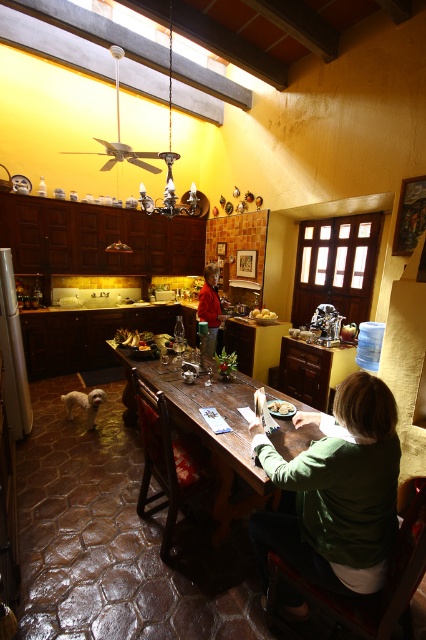
Question: Can you confirm if red fabric shirt at center is bigger than smooth brown bread at table center?

Choices:
 (A) yes
 (B) no

Answer: (A)

Question: Which point is closer to the camera?

Choices:
 (A) smooth brown bread at table center
 (B) matte silver tray at center

Answer: (A)

Question: Is green cotton shirt at center further to camera compared to brown wooden table at center?

Choices:
 (A) no
 (B) yes

Answer: (A)

Question: Which point appears closest to the camera in this image?

Choices:
 (A) (253, 486)
 (B) (132, 336)
 (C) (216, 316)

Answer: (A)

Question: Does brown wooden table at center have a greater width compared to yellow matte potatoes at center?

Choices:
 (A) yes
 (B) no

Answer: (A)

Question: Which of the following is the closest to the observer?

Choices:
 (A) (294, 600)
 (B) (276, 412)
 (C) (224, 406)

Answer: (A)